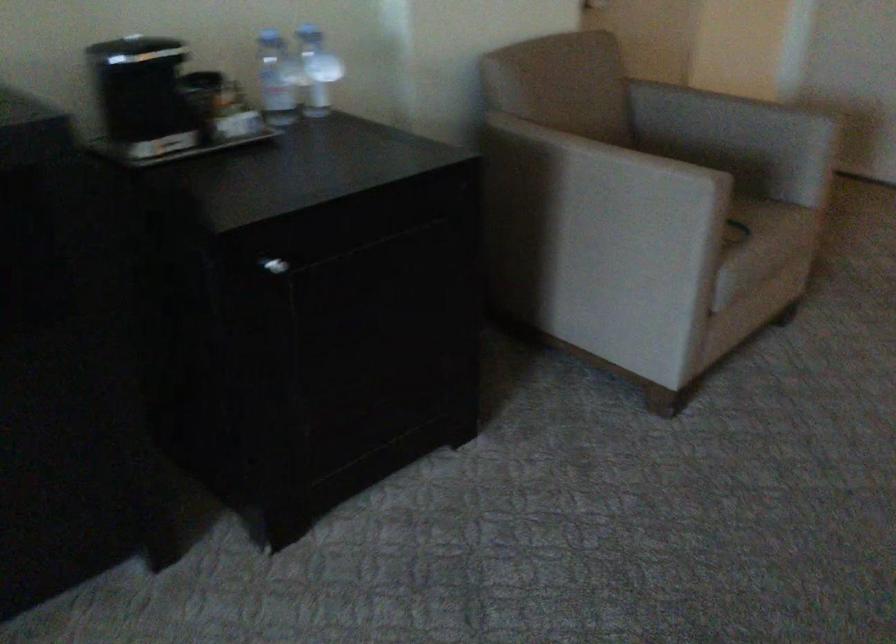
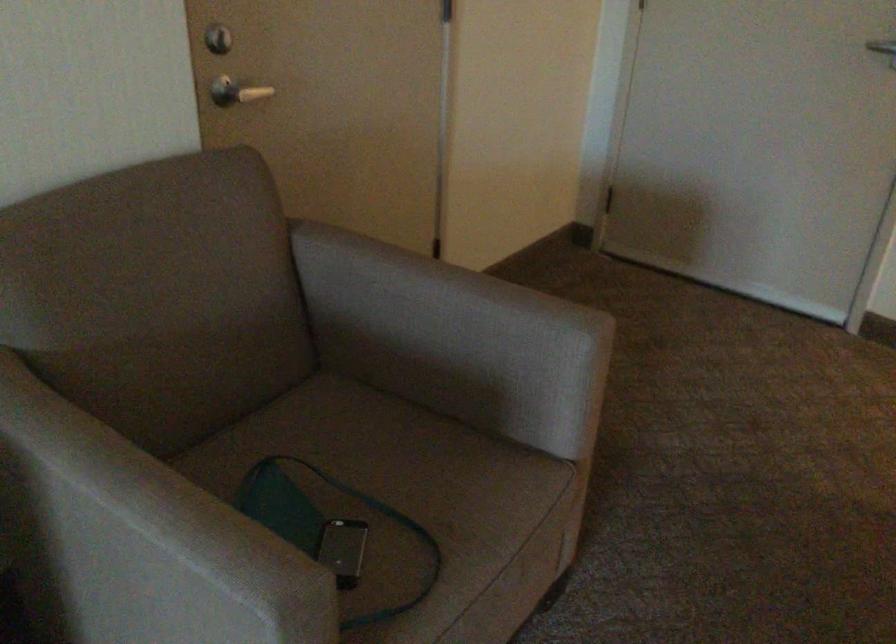
Locate, in the second image, the point that corresponds to pixel 743 129 in the first image.

(453, 339)